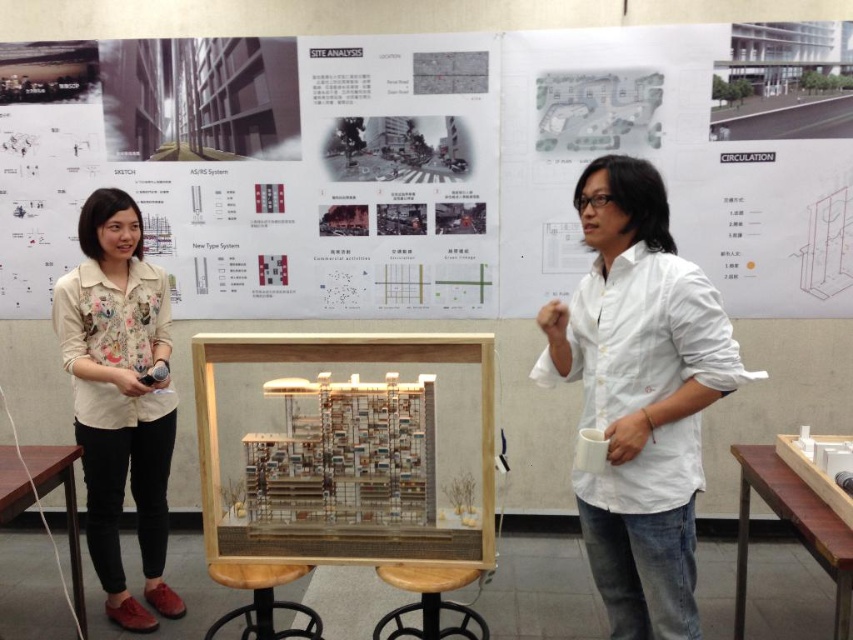
What is the object located at the coordinate point (428, 600) in the image?

The object located at the coordinate point (428, 600) is the wooden stool at center.

You are an attendee at the presentation and want to take a photo of the white cotton shirt at center and the brown wooden stool at lower center. Which object will appear larger in your photo?

The white cotton shirt at center will appear larger in the photo because it has a larger size compared to the brown wooden stool at lower center.